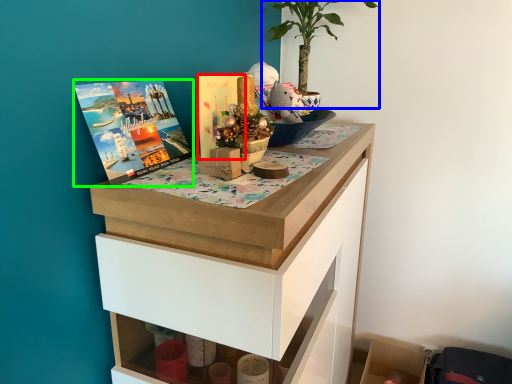
Question: Considering the real-world distances, which object is farthest from book cover (highlighted by a red box)? houseplant (highlighted by a blue box) or book cover (highlighted by a green box)?

Choices:
 (A) houseplant
 (B) book cover

Answer: (A)